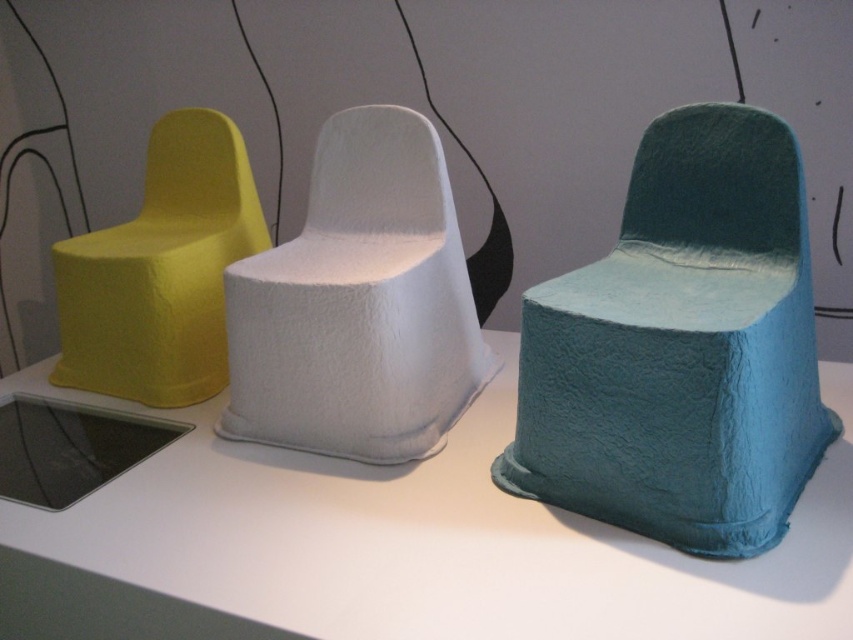
Consider the image. Can you confirm if teal felt armchair at center is positioned to the right of matte yellow armchair at left?

Indeed, teal felt armchair at center is positioned on the right side of matte yellow armchair at left.

Between point (747, 248) and point (216, 269), which one is positioned behind?

Point (216, 269)

The height and width of the screenshot is (640, 853). What do you see at coordinates (682, 348) in the screenshot?
I see `teal felt armchair at center` at bounding box center [682, 348].

Find the location of a particular element. teal felt armchair at center is located at coordinates (682, 348).

Between point (360, 323) and point (113, 321), which one is positioned in front?

Point (360, 323)

Who is higher up, white felt armchair at center or matte yellow armchair at left?

Positioned higher is matte yellow armchair at left.

What do you see at coordinates (358, 305) in the screenshot? This screenshot has height=640, width=853. I see `white felt armchair at center` at bounding box center [358, 305].

This screenshot has height=640, width=853. Identify the location of white felt armchair at center. (358, 305).

Can you confirm if white matte table at center is positioned to the left of matte yellow armchair at left?

Incorrect, white matte table at center is not on the left side of matte yellow armchair at left.

Which is more to the right, white matte table at center or matte yellow armchair at left?

white matte table at center is more to the right.

Is point (297, 605) in front of point (201, 168)?

Yes, it is.

Find the location of a particular element. The width and height of the screenshot is (853, 640). white matte table at center is located at coordinates (413, 545).